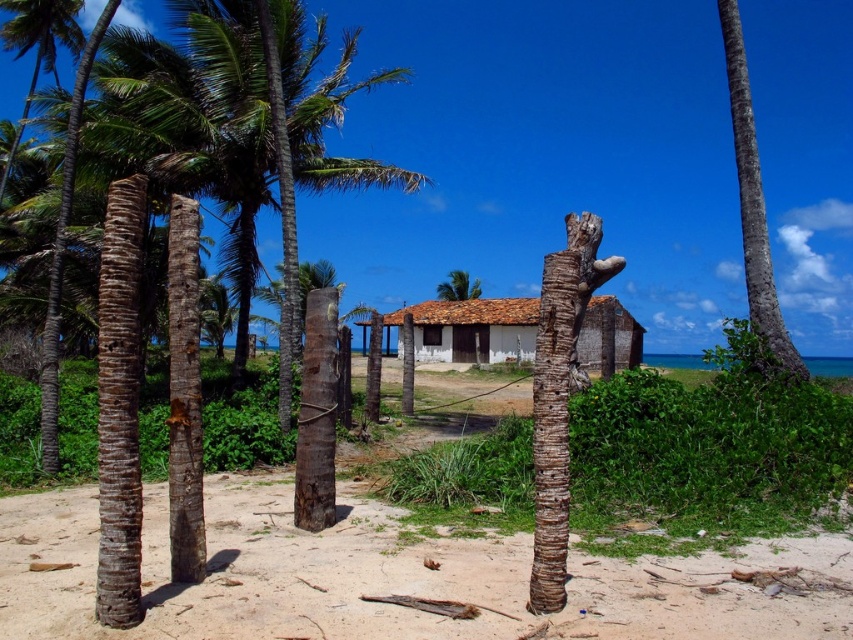
Question: Observing the image, what is the correct spatial positioning of white wooden hut at center in reference to brown rough bark tree at right?

Choices:
 (A) left
 (B) right

Answer: (A)

Question: In this image, where is brown rough tree trunk at center located relative to brown rough bark tree at right?

Choices:
 (A) right
 (B) left

Answer: (B)

Question: Which object is positioned farthest from the brown rough tree trunk at center?

Choices:
 (A) brown sandy soil at center
 (B) brown rough bark tree at right
 (C) white wooden hut at center

Answer: (C)

Question: Can you confirm if brown sandy soil at center is thinner than brown rough bark tree at right?

Choices:
 (A) no
 (B) yes

Answer: (B)

Question: Among these points, which one is nearest to the camera?

Choices:
 (A) (463, 630)
 (B) (775, 307)

Answer: (A)

Question: Which point is closer to the camera?

Choices:
 (A) (758, 180)
 (B) (650, 612)
 (C) (526, 339)
 (D) (543, 604)

Answer: (D)